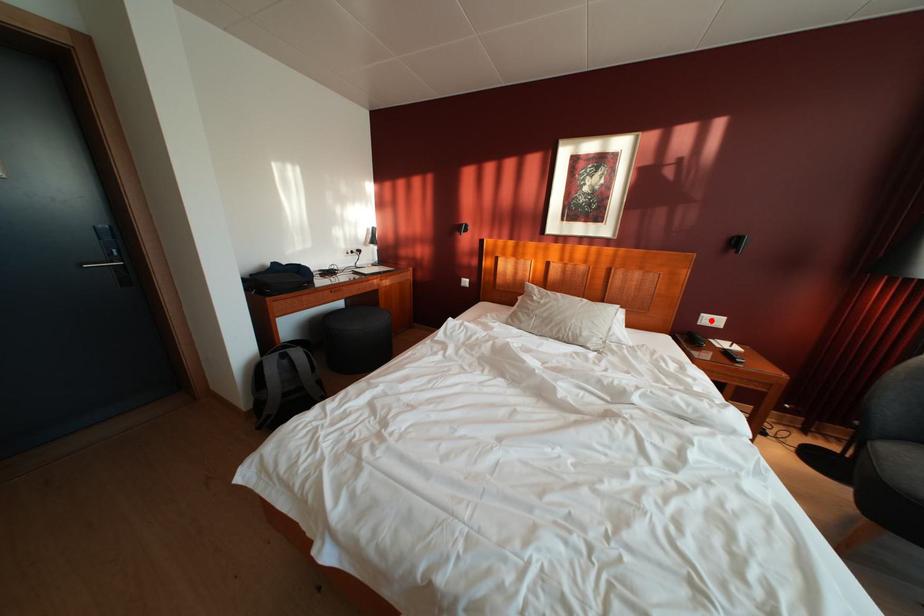
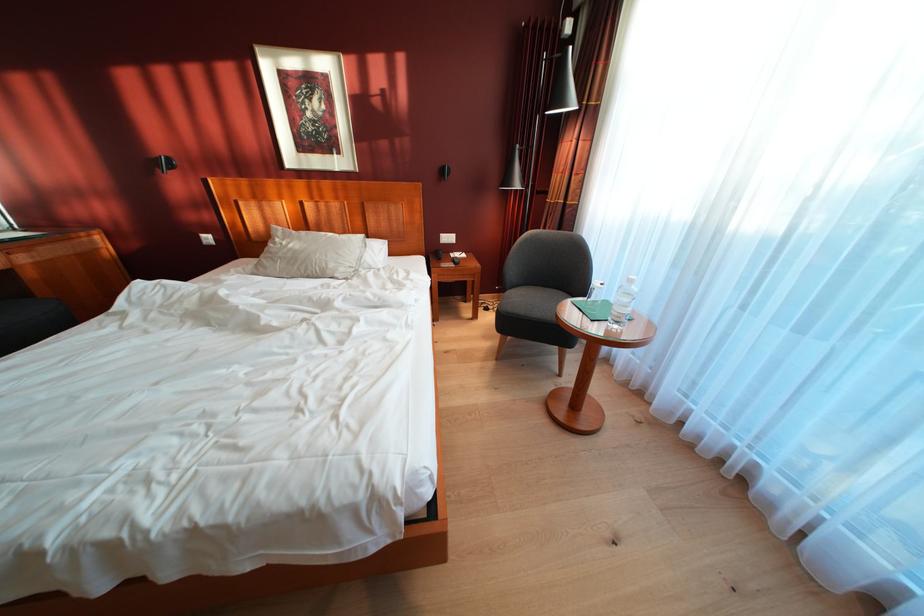
The point at the highlighted location is marked in the first image. Where is the corresponding point in the second image?

(450, 241)